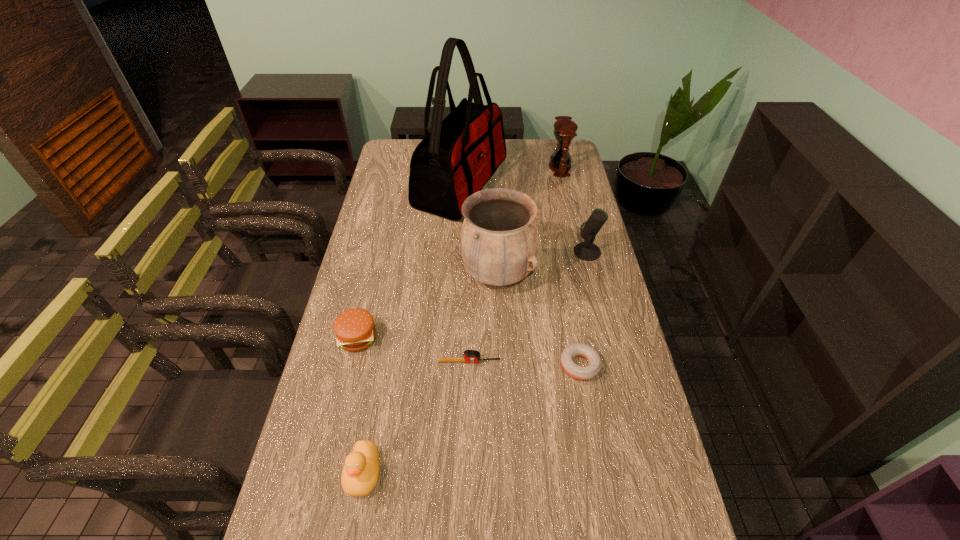
Where is `free region located 0.100m on the front of the seventh shortest object`? This screenshot has height=540, width=960. free region located 0.100m on the front of the seventh shortest object is located at coordinates (500, 327).

At what (x,y) coordinates should I click in order to perform the action: click on vacant space situated 0.070m on the back of the hourglass. Please return your answer as a coordinate pair (x, y). Image resolution: width=960 pixels, height=540 pixels. Looking at the image, I should click on (556, 150).

At what (x,y) coordinates should I click in order to perform the action: click on vacant space located 0.190m on the front of the microphone. Please return your answer as a coordinate pair (x, y). The image size is (960, 540). Looking at the image, I should click on (599, 301).

Image resolution: width=960 pixels, height=540 pixels. Find the location of `vacant space located 0.050m on the face of the nearest object`. vacant space located 0.050m on the face of the nearest object is located at coordinates (354, 524).

Find the location of a particular element. Image resolution: width=960 pixels, height=540 pixels. free point located on the back of the hamburger is located at coordinates (371, 285).

At what (x,y) coordinates should I click in order to perform the action: click on vacant space located 0.110m on the back of the tape measure. Please return your answer as a coordinate pair (x, y). The height and width of the screenshot is (540, 960). Looking at the image, I should click on (470, 328).

This screenshot has height=540, width=960. I want to click on vacant space situated 0.180m on the back of the doughnut, so click(568, 302).

At what (x,y) coordinates should I click in order to perform the action: click on duffel bag positioned at the far edge. Please return your answer as a coordinate pair (x, y). This screenshot has width=960, height=540. Looking at the image, I should click on (461, 153).

What are the coordinates of `hourglass that is at the far edge` in the screenshot? It's located at (565, 129).

Locate an element on the screen. duffel bag present at the left edge is located at coordinates (461, 153).